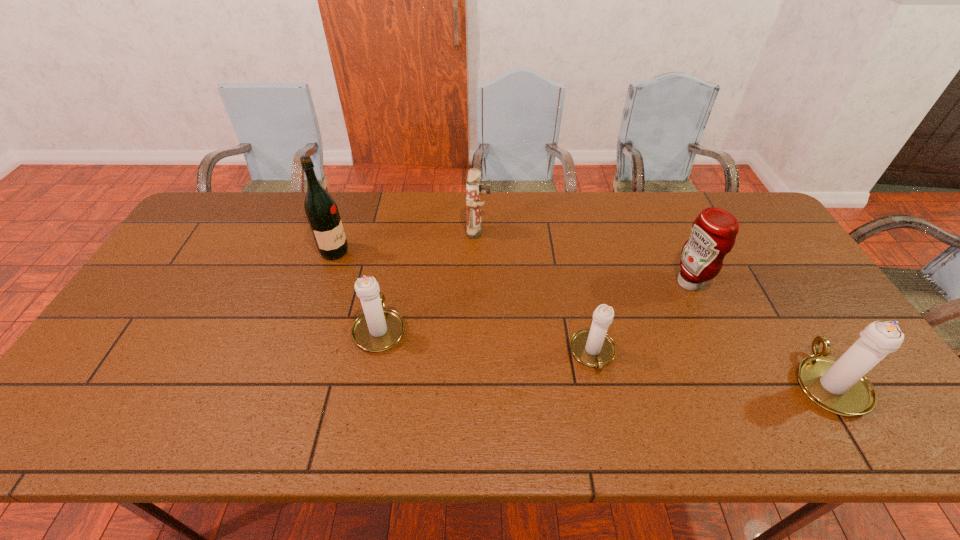
Where is `the second object from right to left`? This screenshot has height=540, width=960. the second object from right to left is located at coordinates (713, 233).

You are a GUI agent. You are given a task and a screenshot of the screen. Output one action in this format:
    pyautogui.click(x=<x>, y=<y>)
    Task: Click on the vacant region located 0.360m on the handle side of the leftmost candle holder
    The image size is (960, 540).
    Given the screenshot: What is the action you would take?
    pyautogui.click(x=400, y=222)

This screenshot has height=540, width=960. What are the coordinates of `blank space located 0.250m on the handle side of the leftmost candle holder` in the screenshot? It's located at (396, 245).

Image resolution: width=960 pixels, height=540 pixels. Identify the location of vacant space located on the handle side of the leftmost candle holder. (397, 240).

The image size is (960, 540). Find the location of `vacant space situated 0.060m on the handle side of the shortest candle holder`. vacant space situated 0.060m on the handle side of the shortest candle holder is located at coordinates (603, 400).

Locate an element on the screen. The height and width of the screenshot is (540, 960). free location located on the handle side of the rightmost candle holder is located at coordinates (753, 259).

The width and height of the screenshot is (960, 540). I want to click on free space located 0.140m on the handle side of the rightmost candle holder, so click(781, 306).

Where is `vacant space located on the handle side of the rightmost candle holder`? The image size is (960, 540). vacant space located on the handle side of the rightmost candle holder is located at coordinates (788, 318).

Image resolution: width=960 pixels, height=540 pixels. What are the coordinates of `free region located on the front-facing side of the second farthest object` in the screenshot? It's located at (457, 252).

Identify the location of free space located on the front-facing side of the fourth object from right to left. Image resolution: width=960 pixels, height=540 pixels. (612, 232).